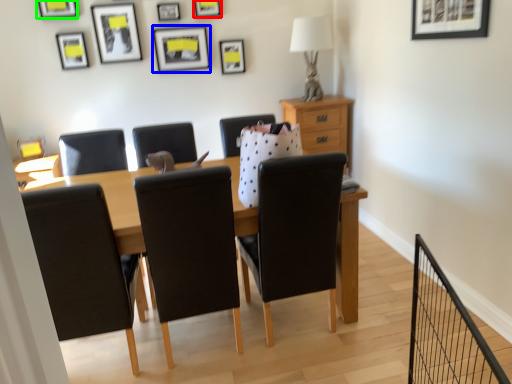
Question: Which is farther away from picture frame (highlighted by a red box)? picture frame (highlighted by a blue box) or picture frame (highlighted by a green box)?

Choices:
 (A) picture frame
 (B) picture frame

Answer: (B)